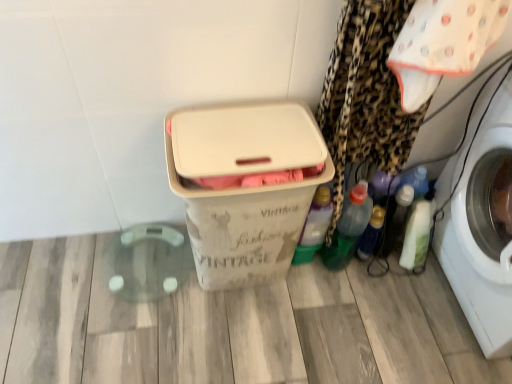
The image size is (512, 384). Identify the location of free spot to the right of green plastic bottle at lower right, marked as the second bottle in a left-to-right arrangement. (381, 281).